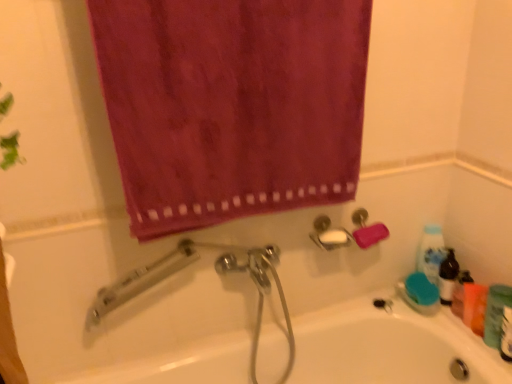
Question: From a real-world perspective, is velvet-like magenta towel at upper center below green matte bottle at lower right?

Choices:
 (A) yes
 (B) no

Answer: (B)

Question: Is green matte bottle at lower right a part of velvet-like magenta towel at upper center?

Choices:
 (A) yes
 (B) no

Answer: (B)

Question: From the image's perspective, is velvet-like magenta towel at upper center located beneath green matte bottle at lower right?

Choices:
 (A) no
 (B) yes

Answer: (A)

Question: Is the depth of velvet-like magenta towel at upper center greater than that of green matte bottle at lower right?

Choices:
 (A) no
 (B) yes

Answer: (A)

Question: Is velvet-like magenta towel at upper center at the right side of green matte bottle at lower right?

Choices:
 (A) yes
 (B) no

Answer: (B)

Question: Is green plastic mouthwash at lower right, which is counted as the first mouthwash, starting from the right, inside the boundaries of white glossy bathtub at center, or outside?

Choices:
 (A) outside
 (B) inside

Answer: (A)

Question: Considering the positions of green plastic mouthwash at lower right, which appears as the second mouthwash when viewed from the left, and white glossy bathtub at center in the image, is green plastic mouthwash at lower right, which appears as the second mouthwash when viewed from the left, bigger or smaller than white glossy bathtub at center?

Choices:
 (A) small
 (B) big

Answer: (A)

Question: Does point (508, 357) appear closer or farther from the camera than point (479, 339)?

Choices:
 (A) closer
 (B) farther

Answer: (A)

Question: From a real-world perspective, is green plastic mouthwash at lower right, which appears as the second mouthwash when viewed from the left, above or below white glossy bathtub at center?

Choices:
 (A) below
 (B) above

Answer: (B)

Question: Does point (470, 294) appear closer or farther from the camera than point (497, 286)?

Choices:
 (A) farther
 (B) closer

Answer: (A)

Question: From a real-world perspective, is orange matte bottle at right, the first mouthwash from the back, positioned above or below green matte bottle at lower right?

Choices:
 (A) above
 (B) below

Answer: (B)

Question: In terms of size, does orange matte bottle at right, marked as the first mouthwash in a left-to-right arrangement, appear bigger or smaller than green matte bottle at lower right?

Choices:
 (A) small
 (B) big

Answer: (A)

Question: In the image, is orange matte bottle at right, the second mouthwash in the right-to-left sequence, on the left side or the right side of green matte bottle at lower right?

Choices:
 (A) right
 (B) left

Answer: (B)

Question: From their relative heights in the image, would you say velvet-like magenta towel at upper center is taller or shorter than green matte bottle at lower right?

Choices:
 (A) short
 (B) tall

Answer: (B)

Question: Looking at their shapes, would you say velvet-like magenta towel at upper center is wider or thinner than green matte bottle at lower right?

Choices:
 (A) thin
 (B) wide

Answer: (A)